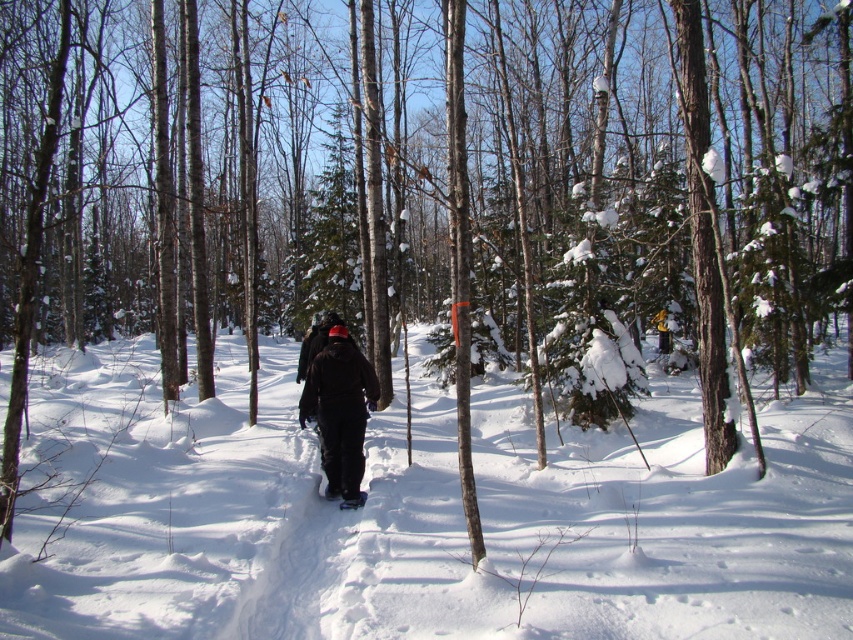
Question: In this image, where is black fabric skier at center located relative to white rubber snowshoe at center?

Choices:
 (A) below
 (B) above

Answer: (B)

Question: Does white rubber snowshoe at center have a lesser width compared to white matte snowshoe at center?

Choices:
 (A) no
 (B) yes

Answer: (A)

Question: Based on their relative distances, which object is nearer to the white rubber snowshoe at center?

Choices:
 (A) white fluffy snow at center
 (B) white matte snowshoe at center

Answer: (B)

Question: Among these points, which one is nearest to the camera?

Choices:
 (A) (329, 458)
 (B) (363, 492)
 (C) (335, 490)
 (D) (283, 556)

Answer: (D)

Question: Does white fluffy snow at center have a greater width compared to black fabric skier at center?

Choices:
 (A) no
 (B) yes

Answer: (B)

Question: Which object is the farthest from the white fluffy snow at center?

Choices:
 (A) white matte snowshoe at center
 (B) white rubber snowshoe at center
 (C) black fabric skier at center

Answer: (A)